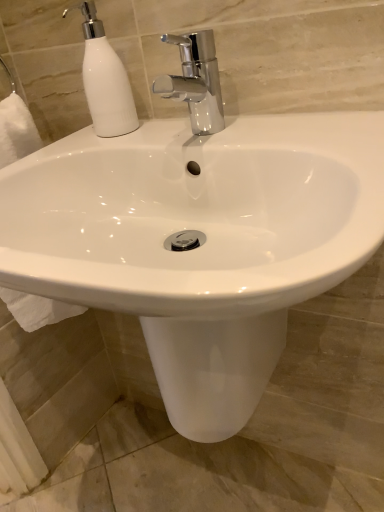
This screenshot has width=384, height=512. Find the location of `vacant area that lies between white matte soap dispenser at upper left and chrome metallic faucet at upper center`. vacant area that lies between white matte soap dispenser at upper left and chrome metallic faucet at upper center is located at coordinates (150, 134).